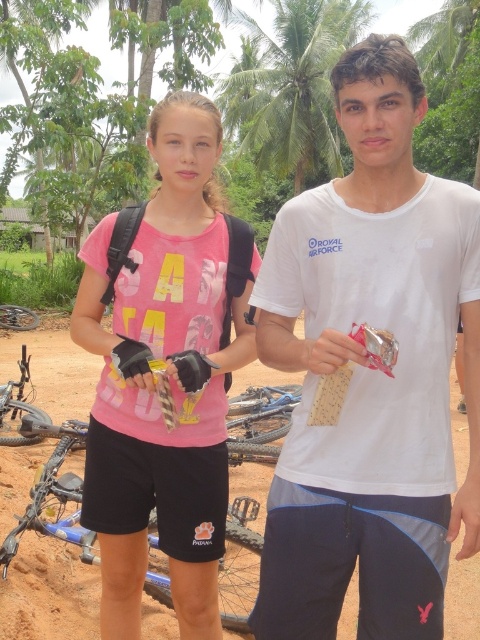
Does white cotton t-shirt at center have a greater height compared to pink matte shirt at center?

No.

Is point (362, 516) more distant than point (180, 636)?

No, it is in front of (180, 636).

Which is in front, point (300, 580) or point (191, 419)?

Point (300, 580) is more forward.

You are a GUI agent. You are given a task and a screenshot of the screen. Output one action in this format:
    pyautogui.click(x=<x>, y=<y>)
    Task: Click on the white cotton t-shirt at center
    This screenshot has height=640, width=480.
    Given the screenshot: What is the action you would take?
    pyautogui.click(x=371, y=372)

Does point (284, 445) come behind point (74, 381)?

That is False.

Is white cotton t-shirt at center further to camera compared to brown dirt track at center?

No, it is not.

Which is behind, point (371, 132) or point (82, 579)?

The point (82, 579) is behind.

I want to click on white cotton t-shirt at center, so click(x=371, y=372).

Does brown dirt track at center have a greater height compared to green leafy palm tree at upper center?

No, brown dirt track at center is not taller than green leafy palm tree at upper center.

Can you confirm if brown dirt track at center is positioned to the left of green leafy palm tree at upper center?

Indeed, brown dirt track at center is positioned on the left side of green leafy palm tree at upper center.

The width and height of the screenshot is (480, 640). What do you see at coordinates (48, 595) in the screenshot?
I see `brown dirt track at center` at bounding box center [48, 595].

This screenshot has height=640, width=480. Find the location of `brown dirt track at center`. brown dirt track at center is located at coordinates (48, 595).